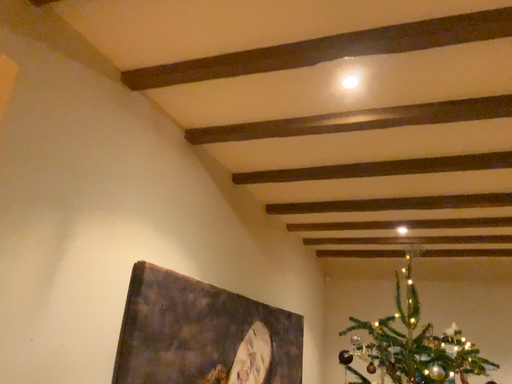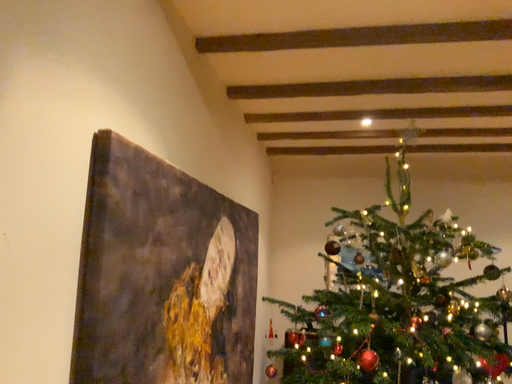
Question: How did the camera likely rotate when shooting the video?

Choices:
 (A) rotated left
 (B) rotated right

Answer: (B)